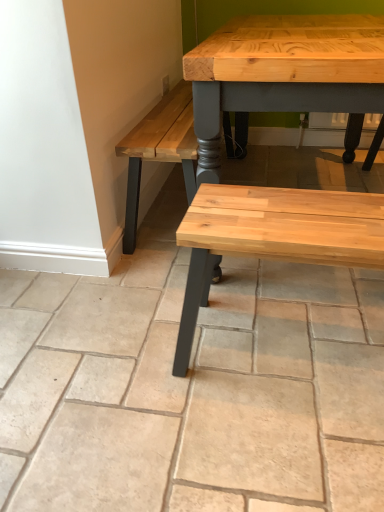
Question: From a real-world perspective, is natural wood bench at center above or below natural stone bench at center?

Choices:
 (A) above
 (B) below

Answer: (A)

Question: From the image's perspective, is natural wood bench at center positioned above or below natural stone bench at center?

Choices:
 (A) below
 (B) above

Answer: (A)

Question: Which is correct: natural wood bench at center is inside natural stone bench at center, or outside of it?

Choices:
 (A) outside
 (B) inside

Answer: (A)

Question: Is natural stone bench at center in front of or behind natural wood bench at center in the image?

Choices:
 (A) behind
 (B) front

Answer: (B)

Question: Does point (62, 490) appear closer or farther from the camera than point (188, 306)?

Choices:
 (A) closer
 (B) farther

Answer: (A)

Question: Looking at the image, does natural stone bench at center seem bigger or smaller compared to natural wood bench at center?

Choices:
 (A) big
 (B) small

Answer: (A)

Question: In the image, is natural stone bench at center on the left side or the right side of natural wood bench at center?

Choices:
 (A) right
 (B) left

Answer: (B)